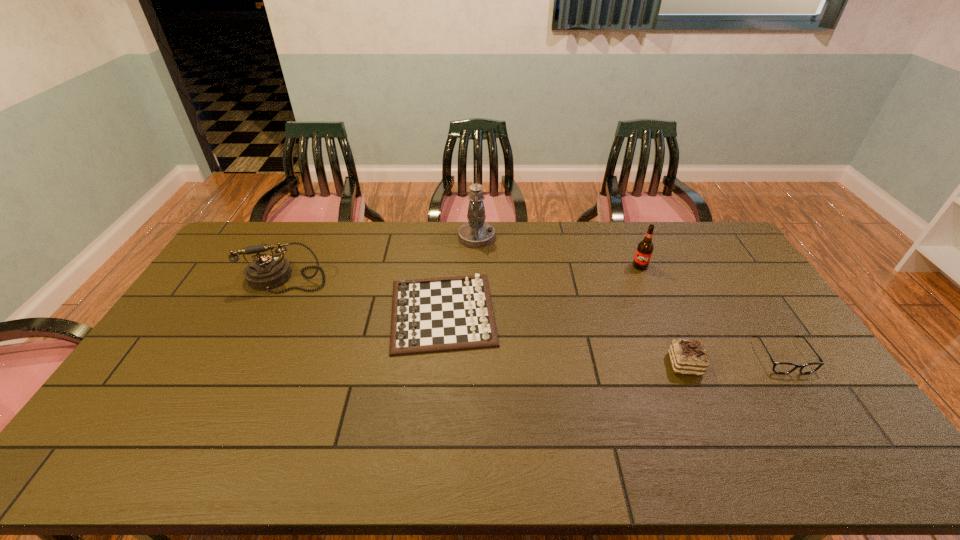
At what (x,y) coordinates should I click in order to perform the action: click on free space between the tallest object and the chocolate cake. Please return your answer as a coordinate pair (x, y). The width and height of the screenshot is (960, 540). Looking at the image, I should click on click(x=581, y=301).

You are a GUI agent. You are given a task and a screenshot of the screen. Output one action in this format:
    pyautogui.click(x=<x>, y=<y>)
    Task: Click on the vacant area that lies between the oil lamp and the rightmost object
    
    Given the screenshot: What is the action you would take?
    pyautogui.click(x=630, y=297)

Identify the location of vacant region between the chocolate cake and the root beer. (662, 315).

Identify the location of unoccupied position between the fifth tallest object and the root beer. The height and width of the screenshot is (540, 960). (541, 289).

What are the coordinates of `free point between the chocolate cake and the shortest object` in the screenshot? It's located at (733, 361).

The image size is (960, 540). In order to click on empty space between the chocolate cake and the rightmost object in this screenshot , I will do `click(733, 361)`.

The width and height of the screenshot is (960, 540). I want to click on unoccupied position between the chessboard and the telephone, so click(365, 295).

Where is `vacant space that's between the telephone and the shortest object`? This screenshot has height=540, width=960. vacant space that's between the telephone and the shortest object is located at coordinates (535, 318).

Find the location of a particular element. free spot between the telephone and the tallest object is located at coordinates (382, 258).

Where is `vacant space that's between the chessboard and the farthest object`? vacant space that's between the chessboard and the farthest object is located at coordinates (460, 275).